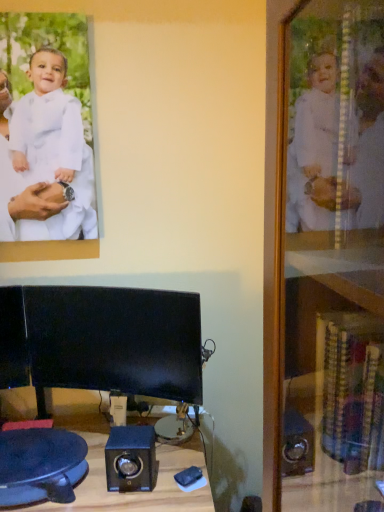
Locate an element on the screen. white satin baby at upper left is located at coordinates (40, 190).

Describe the element at coordinates (40, 190) in the screenshot. I see `white satin baby at upper left` at that location.

You are a GUI agent. You are given a task and a screenshot of the screen. Output one action in this format:
    pyautogui.click(x=<x>, y=<y>)
    Task: Click on the white satin baby at upper left
    
    Given the screenshot: What is the action you would take?
    pyautogui.click(x=40, y=190)